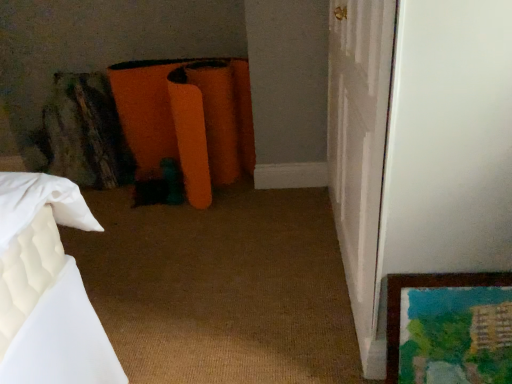
Identify the location of wooden framed painting at lower right. (426, 287).

What do you see at coordinates (426, 287) in the screenshot?
I see `wooden framed painting at lower right` at bounding box center [426, 287].

Identify the location of wooden framed painting at lower right. (426, 287).